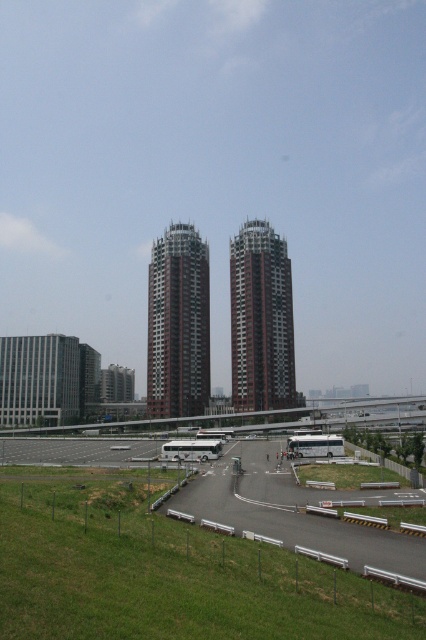
This screenshot has height=640, width=426. Identify the location of white concrete race track at lower center. (290, 513).

Consider the image. Who is shorter, white concrete race track at lower center or brown textured building at center?

white concrete race track at lower center

Who is more forward, (x=235, y=483) or (x=250, y=348)?

Point (x=235, y=483) is in front.

Where is `white concrete race track at lower center`? Image resolution: width=426 pixels, height=640 pixels. white concrete race track at lower center is located at coordinates (290, 513).

Is white concrete race track at lower center wider than red brick building at center?

Yes.

In the scene shown: Between white concrete race track at lower center and red brick building at center, which one appears on the left side from the viewer's perspective?

From the viewer's perspective, red brick building at center appears more on the left side.

The width and height of the screenshot is (426, 640). In order to click on white concrete race track at lower center in this screenshot , I will do 290,513.

Measure the distance between point (x=170, y=298) and camera.

159.55 meters

From the picture: Which is below, red brick building at center or brown textured building at center?

red brick building at center

Where is `red brick building at center`? This screenshot has width=426, height=640. red brick building at center is located at coordinates (178, 323).